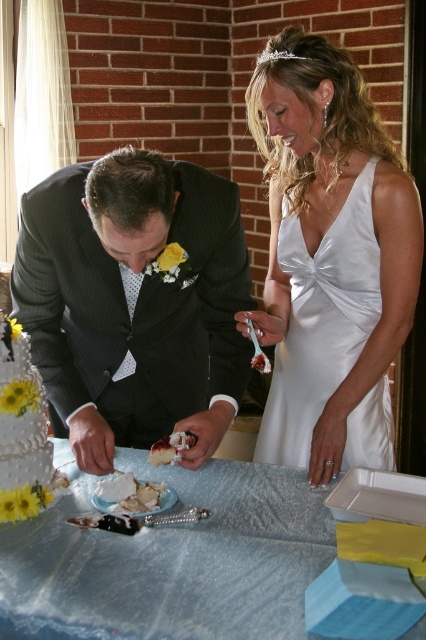
You are a photographer at a wedding reception. You need to capture a photo of the white satin cocktail dress at center and the white cake at center. The camera you are using has a limited focus range. Which object should you focus on to ensure it appears sharp, considering their sizes?

The white satin cocktail dress at center is bigger than the white cake at center, so you should focus on the white satin cocktail dress at center to ensure it appears sharp.

You are a photographer at a wedding. You need to capture a photo of the dark gray suit at center and the white cake at center. The camera has a maximum width of 1 meter. Can you fit both objects in the frame without moving the camera?

The dark gray suit at center might be wider than white cake at center. Since the camera has a maximum width of 1 meter, it is uncertain if both objects can fit without moving the camera. The photographer should check the combined width of both objects to ensure they are within the camera frame limit.